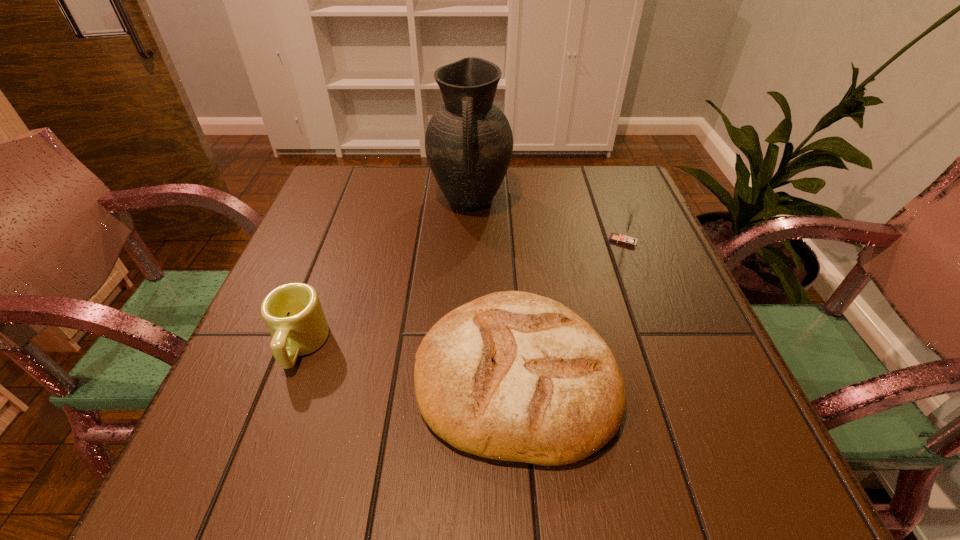
The width and height of the screenshot is (960, 540). Find the location of `the tallest object`. the tallest object is located at coordinates (468, 142).

The width and height of the screenshot is (960, 540). In order to click on pitcher in this screenshot , I will do `click(468, 142)`.

Where is `the rightmost object`? the rightmost object is located at coordinates (632, 210).

Where is `the third nearest object`? The image size is (960, 540). the third nearest object is located at coordinates (632, 210).

You are a GUI agent. You are given a task and a screenshot of the screen. Output one action in this format:
    pyautogui.click(x=<x>, y=<y>)
    Task: Click on the bread
    
    Given the screenshot: What is the action you would take?
    pyautogui.click(x=514, y=376)

The height and width of the screenshot is (540, 960). Find the location of `the leftmost object`. the leftmost object is located at coordinates (293, 314).

The width and height of the screenshot is (960, 540). I want to click on vacant space located on the side of the farthest object with the handle, so click(x=467, y=326).

You are a GUI agent. You are given a task and a screenshot of the screen. Output one action in this format:
    pyautogui.click(x=<x>, y=<y>)
    Task: Click on the free space located 0.140m on the left of the rightmost object
    
    Given the screenshot: What is the action you would take?
    pyautogui.click(x=548, y=241)

Locate an element on the screen. vacant space located on the back of the bread is located at coordinates (507, 237).

Image resolution: width=960 pixels, height=540 pixels. Find the location of `vacant space located with the handle on the side of the leftmost object`. vacant space located with the handle on the side of the leftmost object is located at coordinates (246, 491).